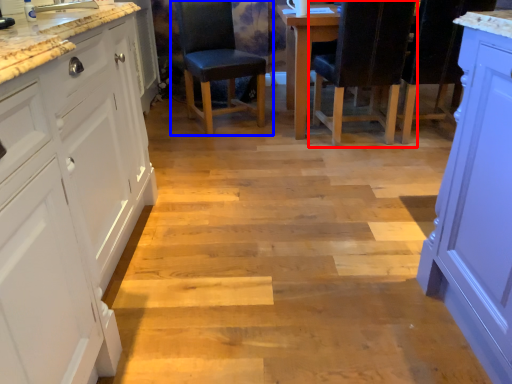
Question: Which object is further to the camera taking this photo, chair (highlighted by a red box) or chair (highlighted by a blue box)?

Choices:
 (A) chair
 (B) chair

Answer: (B)